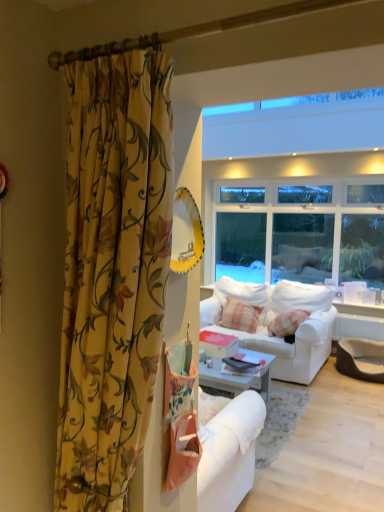
Question: Is floral fabric curtain at left smaller than striped cotton pillow at center?

Choices:
 (A) yes
 (B) no

Answer: (B)

Question: Can striped cotton pillow at center be found inside floral fabric curtain at left?

Choices:
 (A) yes
 (B) no

Answer: (B)

Question: From the image's perspective, does floral fabric curtain at left appear higher than striped cotton pillow at center?

Choices:
 (A) yes
 (B) no

Answer: (A)

Question: Does floral fabric curtain at left touch striped cotton pillow at center?

Choices:
 (A) yes
 (B) no

Answer: (B)

Question: Is floral fabric curtain at left positioned with its back to striped cotton pillow at center?

Choices:
 (A) no
 (B) yes

Answer: (A)

Question: Does floral fabric curtain at left have a lesser width compared to striped cotton pillow at center?

Choices:
 (A) yes
 (B) no

Answer: (B)

Question: Is floral fabric curtain at left closer to the viewer compared to white fabric couch at center?

Choices:
 (A) yes
 (B) no

Answer: (A)

Question: From the image's perspective, is floral fabric curtain at left above white fabric couch at center?

Choices:
 (A) no
 (B) yes

Answer: (B)

Question: From the image's perspective, is floral fabric curtain at left below white fabric couch at center?

Choices:
 (A) yes
 (B) no

Answer: (B)

Question: Is floral fabric curtain at left shorter than white fabric couch at center?

Choices:
 (A) no
 (B) yes

Answer: (A)

Question: Considering the relative sizes of floral fabric curtain at left and white fabric couch at center in the image provided, is floral fabric curtain at left wider than white fabric couch at center?

Choices:
 (A) no
 (B) yes

Answer: (A)

Question: Could you tell me if floral fabric curtain at left is turned towards white fabric couch at center?

Choices:
 (A) no
 (B) yes

Answer: (A)

Question: Is white fabric couch at center touching striped cotton pillow at center?

Choices:
 (A) yes
 (B) no

Answer: (B)